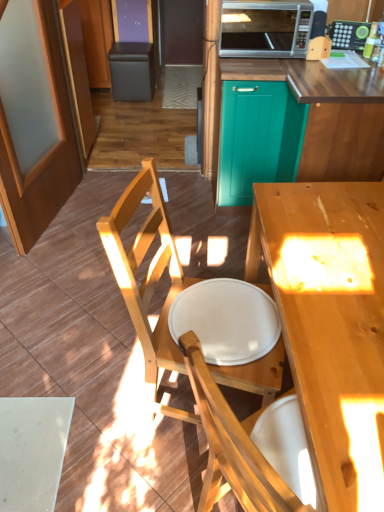
Find the location of a particular element. This screenshot has height=512, width=384. vacant space underneath wooden screen door at left, the first screen door positioned from the left (from a real-world perspective) is located at coordinates (62, 214).